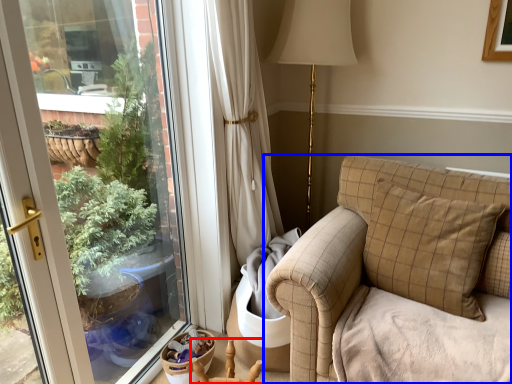
Question: Which of the following is the closest to the observer, armchair (highlighted by a red box) or studio couch (highlighted by a blue box)?

Choices:
 (A) armchair
 (B) studio couch

Answer: (B)